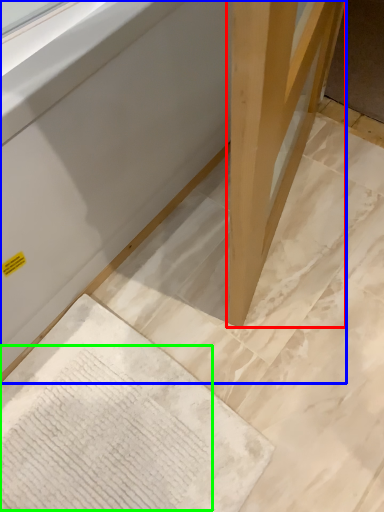
Question: Which object is positioned closest to wood (highlighted by a red box)? Select from furniture (highlighted by a blue box) and writing (highlighted by a green box).

Choices:
 (A) furniture
 (B) writing

Answer: (A)